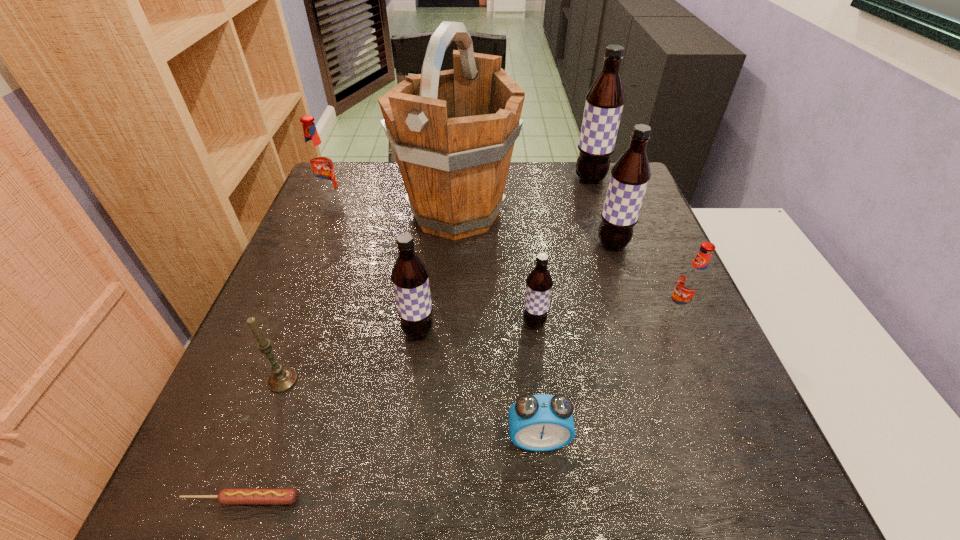
The image size is (960, 540). In order to click on the tallest object in this screenshot , I will do `click(453, 132)`.

Locate an element on the screen. The width and height of the screenshot is (960, 540). the farthest brown root beer is located at coordinates (604, 104).

Where is `the biggest brown root beer`? Image resolution: width=960 pixels, height=540 pixels. the biggest brown root beer is located at coordinates (604, 104).

At what (x,y) coordinates should I click in order to perform the action: click on the fifth shortest root beer. Please return your answer as a coordinate pair (x, y). The width and height of the screenshot is (960, 540). Looking at the image, I should click on (630, 175).

What are the coordinates of `the third nearest brown root beer` in the screenshot? It's located at (630, 175).

Where is `the bigger red root beer`? the bigger red root beer is located at coordinates (319, 164).

I want to click on the farther red root beer, so click(x=319, y=164).

Find the location of a particular element. The width and height of the screenshot is (960, 540). the leftmost brown root beer is located at coordinates (410, 277).

Where is `the third biggest brown root beer`? The height and width of the screenshot is (540, 960). the third biggest brown root beer is located at coordinates (410, 277).

Locate an element on the screen. The width and height of the screenshot is (960, 540). the rightmost root beer is located at coordinates (692, 281).